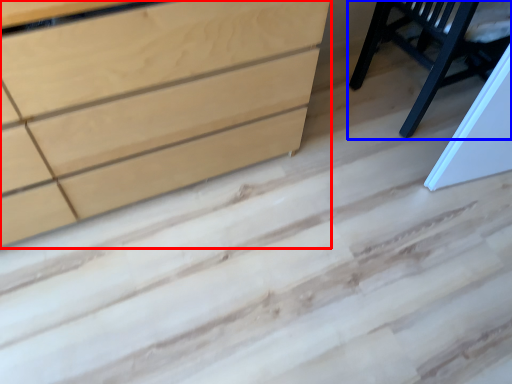
Question: Among these objects, which one is farthest to the camera, chest of drawers (highlighted by a red box) or furniture (highlighted by a blue box)?

Choices:
 (A) chest of drawers
 (B) furniture

Answer: (B)